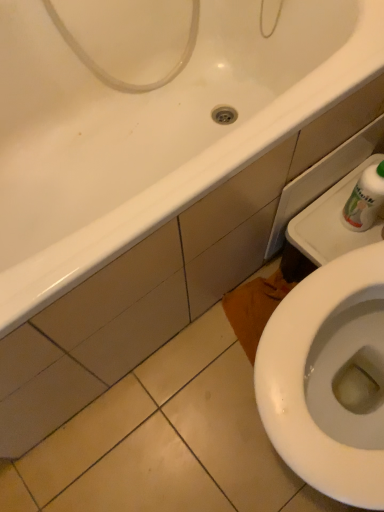
Question: Is white plastic bottle at upper right directly adjacent to white glossy bathtub at upper left?

Choices:
 (A) yes
 (B) no

Answer: (B)

Question: Would you say white plastic bottle at upper right contains white glossy bathtub at upper left?

Choices:
 (A) yes
 (B) no

Answer: (B)

Question: From a real-world perspective, is white plastic bottle at upper right positioned under white glossy bathtub at upper left based on gravity?

Choices:
 (A) yes
 (B) no

Answer: (B)

Question: Is white plastic bottle at upper right far from white glossy bathtub at upper left?

Choices:
 (A) yes
 (B) no

Answer: (B)

Question: Considering the relative positions of white plastic bottle at upper right and white glossy bathtub at upper left in the image provided, is white plastic bottle at upper right in front of white glossy bathtub at upper left?

Choices:
 (A) yes
 (B) no

Answer: (B)

Question: From the image's perspective, would you say white plastic bottle at upper right is shown under white glossy bathtub at upper left?

Choices:
 (A) yes
 (B) no

Answer: (A)

Question: From the image's perspective, is white glossy bathtub at upper left above white plastic bottle at upper right?

Choices:
 (A) yes
 (B) no

Answer: (A)

Question: Is white glossy bathtub at upper left thinner than white plastic bottle at upper right?

Choices:
 (A) yes
 (B) no

Answer: (B)

Question: Does white glossy bathtub at upper left have a lesser height compared to white plastic bottle at upper right?

Choices:
 (A) yes
 (B) no

Answer: (B)

Question: Is white glossy bathtub at upper left to the left of white plastic bottle at upper right from the viewer's perspective?

Choices:
 (A) yes
 (B) no

Answer: (A)

Question: Does white glossy bathtub at upper left have a greater width compared to white plastic bottle at upper right?

Choices:
 (A) no
 (B) yes

Answer: (B)

Question: From the image's perspective, is white glossy bathtub at upper left beneath white plastic bottle at upper right?

Choices:
 (A) yes
 (B) no

Answer: (B)

Question: Looking at their shapes, would you say white glossy bathtub at upper left is wider or thinner than white plastic bottle at upper right?

Choices:
 (A) thin
 (B) wide

Answer: (B)